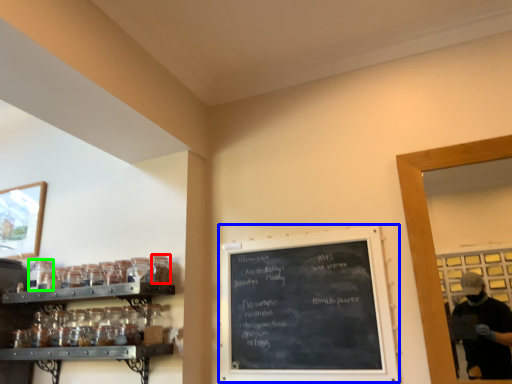
Question: Based on their relative distances, which object is nearer to glass jar (highlighted by a red box)? Choose from bulletin board (highlighted by a blue box) and glass jar (highlighted by a green box).

Choices:
 (A) bulletin board
 (B) glass jar

Answer: (B)